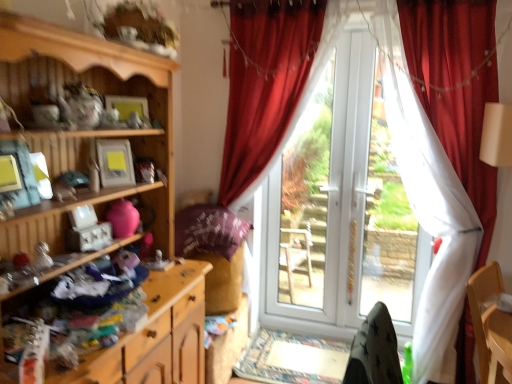
Question: Considering the relative sizes of white plastic door at center, which appears as the 2th bay window when viewed from the right, and velvet red curtain at right, placed as the second curtain when sorted from left to right, in the image provided, is white plastic door at center, which appears as the 2th bay window when viewed from the right, taller than velvet red curtain at right, placed as the second curtain when sorted from left to right,?

Choices:
 (A) yes
 (B) no

Answer: (B)

Question: Is white plastic door at center, which appears as the 2th bay window when viewed from the right, in front of velvet red curtain at right, placed as the second curtain when sorted from left to right?

Choices:
 (A) yes
 (B) no

Answer: (B)

Question: From a real-world perspective, is white plastic door at center, which appears as the 2th bay window when viewed from the right, physically below velvet red curtain at right, the first curtain when ordered from right to left?

Choices:
 (A) no
 (B) yes

Answer: (B)

Question: Considering the relative sizes of white plastic door at center, arranged as the first bay window when viewed from the left, and velvet red curtain at right, placed as the second curtain when sorted from left to right, in the image provided, is white plastic door at center, arranged as the first bay window when viewed from the left, shorter than velvet red curtain at right, placed as the second curtain when sorted from left to right,?

Choices:
 (A) yes
 (B) no

Answer: (A)

Question: From a real-world perspective, is white plastic door at center, which appears as the 2th bay window when viewed from the right, on top of velvet red curtain at right, placed as the second curtain when sorted from left to right?

Choices:
 (A) yes
 (B) no

Answer: (B)

Question: Is velvet red curtain at right, the first curtain when ordered from right to left, inside or outside of wooden cabinet at left, which appears as the 1th cabinetry when viewed from the top?

Choices:
 (A) inside
 (B) outside

Answer: (B)

Question: From the image's perspective, is velvet red curtain at right, placed as the second curtain when sorted from left to right, positioned above or below wooden cabinet at left, which appears as the 1th cabinetry when viewed from the top?

Choices:
 (A) above
 (B) below

Answer: (A)

Question: Is point (430, 54) positioned closer to the camera than point (49, 49)?

Choices:
 (A) closer
 (B) farther

Answer: (B)

Question: From their relative heights in the image, would you say velvet red curtain at right, the first curtain when ordered from right to left, is taller or shorter than wooden cabinet at left, which appears as the 1th cabinetry when viewed from the top?

Choices:
 (A) short
 (B) tall

Answer: (B)

Question: In terms of height, does white glossy screen door at center look taller or shorter compared to velvet red curtain at right, the first curtain when ordered from right to left?

Choices:
 (A) tall
 (B) short

Answer: (B)

Question: Is white glossy screen door at center to the left or to the right of velvet red curtain at right, placed as the second curtain when sorted from left to right, in the image?

Choices:
 (A) right
 (B) left

Answer: (B)

Question: From the image's perspective, is white glossy screen door at center positioned above or below velvet red curtain at right, the first curtain when ordered from right to left?

Choices:
 (A) above
 (B) below

Answer: (A)

Question: Relative to velvet red curtain at right, the first curtain when ordered from right to left, is white glossy screen door at center in front or behind?

Choices:
 (A) front
 (B) behind

Answer: (B)

Question: Would you say wooden dresser at lower left, acting as the 1th cabinetry starting from the bottom, is inside or outside white glossy screen door at center?

Choices:
 (A) inside
 (B) outside

Answer: (B)

Question: In the image, is wooden dresser at lower left, acting as the 1th cabinetry starting from the bottom, positioned in front of or behind white glossy screen door at center?

Choices:
 (A) behind
 (B) front

Answer: (B)